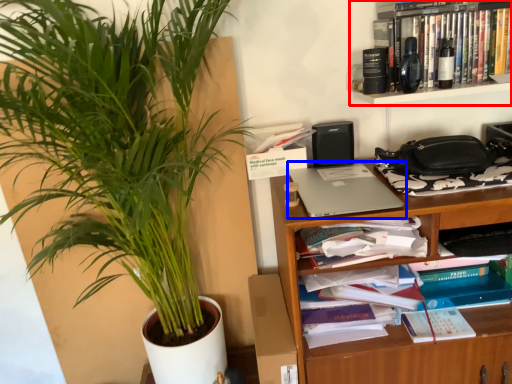
Question: Among these objects, which one is nearest to the camera, shelf (highlighted by a red box) or laptop (highlighted by a blue box)?

Choices:
 (A) shelf
 (B) laptop

Answer: (B)